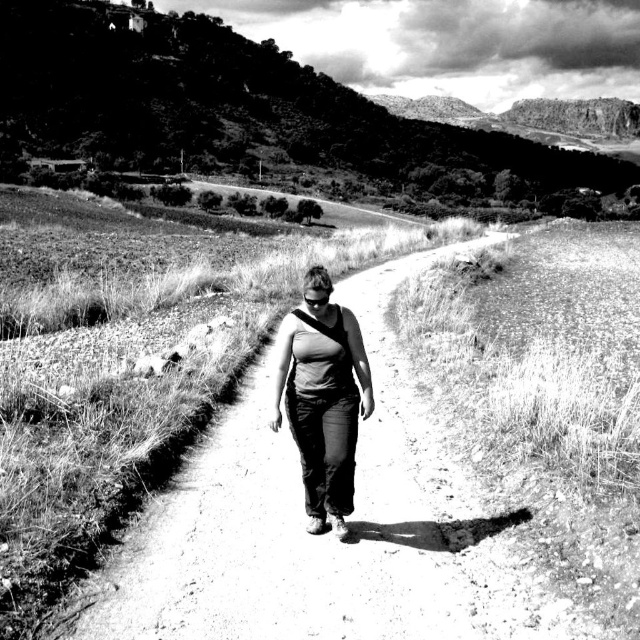
Can you confirm if grassy hillside at upper center is smaller than dark gray fabric tank top at center?

Incorrect, grassy hillside at upper center is not smaller in size than dark gray fabric tank top at center.

Does grassy hillside at upper center have a greater width compared to dark gray fabric tank top at center?

Yes, grassy hillside at upper center is wider than dark gray fabric tank top at center.

Does point (330, 164) come in front of point (339, 518)?

No, (330, 164) is further to viewer.

Where is `grassy hillside at upper center`? This screenshot has height=640, width=640. grassy hillside at upper center is located at coordinates (236, 108).